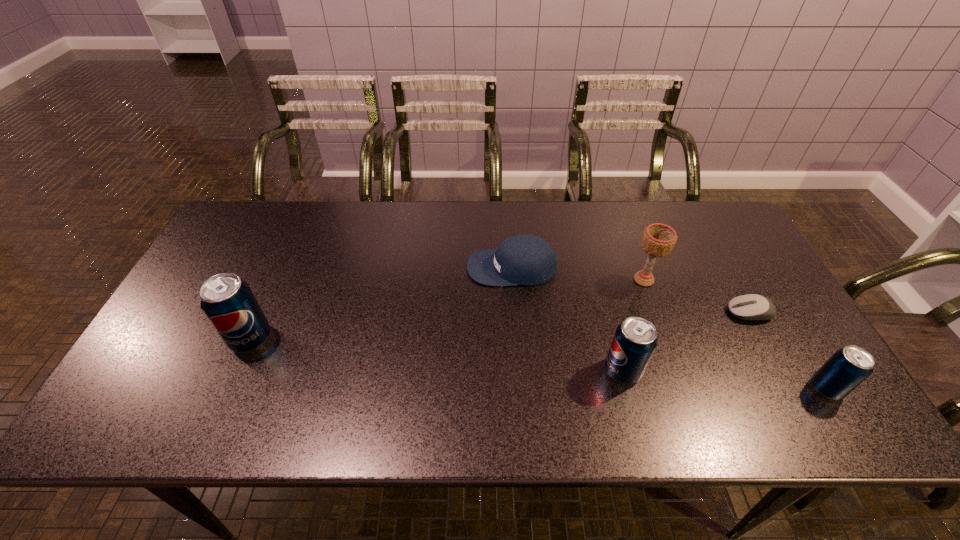
Please point a spot to place another pop_(soda) for symmetrical spacing. Please provide its 2D coordinates. Your answer should be formatted as a tuple, i.e. [(x, y)], where the tuple contains the x and y coordinates of a point satisfying the conditions above.

[(431, 354)]